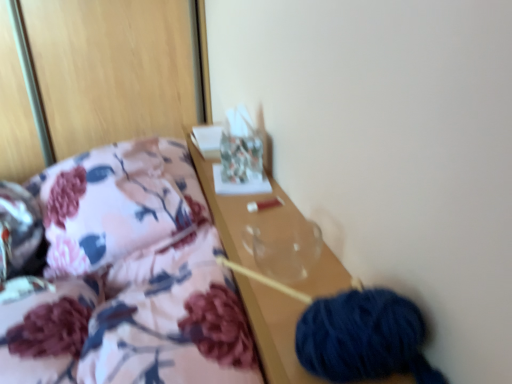
Question: From a real-world perspective, does floral fabric pillow at left stand above transparent glass vase at center?

Choices:
 (A) no
 (B) yes

Answer: (A)

Question: From the image's perspective, is floral fabric pillow at left under transparent glass vase at center?

Choices:
 (A) yes
 (B) no

Answer: (B)

Question: Is floral fabric pillow at left looking in the opposite direction of transparent glass vase at center?

Choices:
 (A) no
 (B) yes

Answer: (A)

Question: Does floral fabric pillow at left have a lesser height compared to transparent glass vase at center?

Choices:
 (A) yes
 (B) no

Answer: (B)

Question: From a real-world perspective, is floral fabric pillow at left beneath transparent glass vase at center?

Choices:
 (A) no
 (B) yes

Answer: (B)

Question: Considering the relative positions of floral fabric pillow at left and transparent glass vase at center in the image provided, is floral fabric pillow at left to the right of transparent glass vase at center from the viewer's perspective?

Choices:
 (A) no
 (B) yes

Answer: (A)

Question: Does floral fabric pillow at left have a smaller size compared to floral fabric at left?

Choices:
 (A) no
 (B) yes

Answer: (A)

Question: Considering the relative positions of floral fabric pillow at left and floral fabric at left in the image provided, is floral fabric pillow at left in front of floral fabric at left?

Choices:
 (A) no
 (B) yes

Answer: (A)

Question: Does floral fabric pillow at left have a greater height compared to floral fabric at left?

Choices:
 (A) no
 (B) yes

Answer: (B)

Question: Could you tell me if floral fabric pillow at left is facing floral fabric at left?

Choices:
 (A) no
 (B) yes

Answer: (A)

Question: Considering the relative sizes of floral fabric pillow at left and floral fabric at left in the image provided, is floral fabric pillow at left wider than floral fabric at left?

Choices:
 (A) yes
 (B) no

Answer: (B)

Question: From a real-world perspective, is floral fabric pillow at left below floral fabric at left?

Choices:
 (A) no
 (B) yes

Answer: (A)

Question: Is transparent glass vase at center oriented towards dark blue yarn at lower right?

Choices:
 (A) yes
 (B) no

Answer: (B)